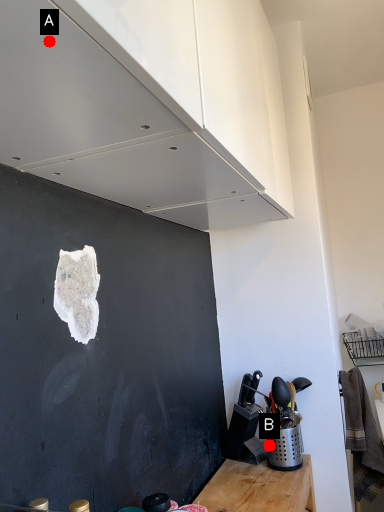
Question: Two points are circled on the image, labeled by A and B beside each circle. Which point appears closest to the camera in this image?

Choices:
 (A) A is closer
 (B) B is closer

Answer: (A)